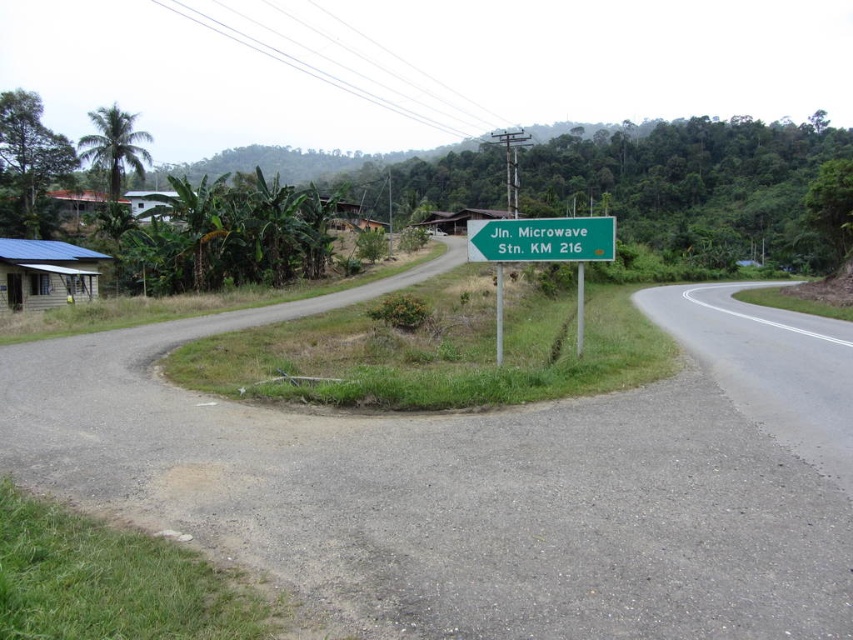
Does green plastic sign at center appear over green metallic sign at center?

Incorrect, green plastic sign at center is not positioned above green metallic sign at center.

Which is in front, point (608, 220) or point (519, 236)?

Point (608, 220)

Which is behind, point (572, 250) or point (485, 243)?

Positioned behind is point (485, 243).

The image size is (853, 640). Identify the location of green plastic sign at center. (540, 252).